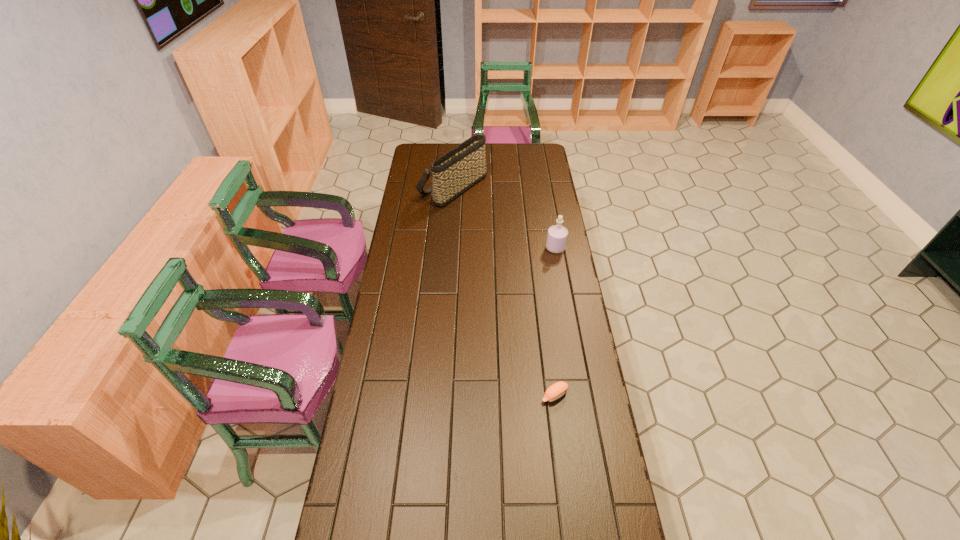
Where is `perfume at the right edge`? This screenshot has height=540, width=960. perfume at the right edge is located at coordinates (557, 235).

Where is `sushi that is at the right edge`? The width and height of the screenshot is (960, 540). sushi that is at the right edge is located at coordinates (557, 390).

Find the location of a particular element. vacant space at the far edge is located at coordinates (x=516, y=154).

Where is `vacant space at the left edge`? vacant space at the left edge is located at coordinates (396, 383).

You are a GUI agent. You are given a task and a screenshot of the screen. Output one action in this format:
    pyautogui.click(x=<x>, y=<y>)
    Task: Click on the empty location between the farthest object and the sushi
    This screenshot has height=540, width=960.
    Given the screenshot: What is the action you would take?
    pyautogui.click(x=504, y=291)

This screenshot has height=540, width=960. What are the coordinates of `blank region between the second object from right to left and the second nearest object` in the screenshot? It's located at (555, 321).

Identify which object is the closest to the tallest object. Please provide its 2D coordinates. Your answer should be formatted as a tuple, i.e. [(x, y)], where the tuple contains the x and y coordinates of a point satisfying the conditions above.

[(557, 235)]

The height and width of the screenshot is (540, 960). Identify the location of the closest object relative to the sushi. (557, 235).

Find the location of `free space that satisfies the following two spatial constraints: 1. on the back side of the perfume; 2. on the left side of the sushi`. free space that satisfies the following two spatial constraints: 1. on the back side of the perfume; 2. on the left side of the sushi is located at coordinates (536, 248).

The image size is (960, 540). I want to click on blank area in the image that satisfies the following two spatial constraints: 1. on the back side of the second farthest object; 2. on the left side of the shortest object, so click(x=536, y=248).